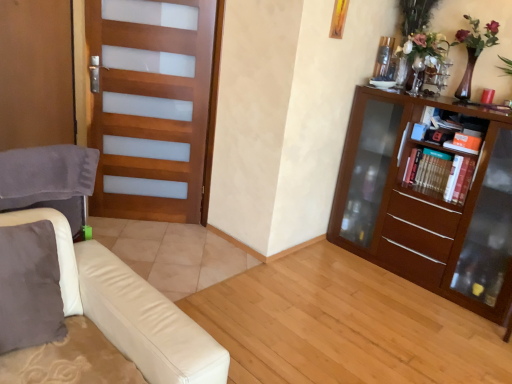
Identify the location of vacant region above wooden bookshelf at right (from a real-world perspective). (441, 148).